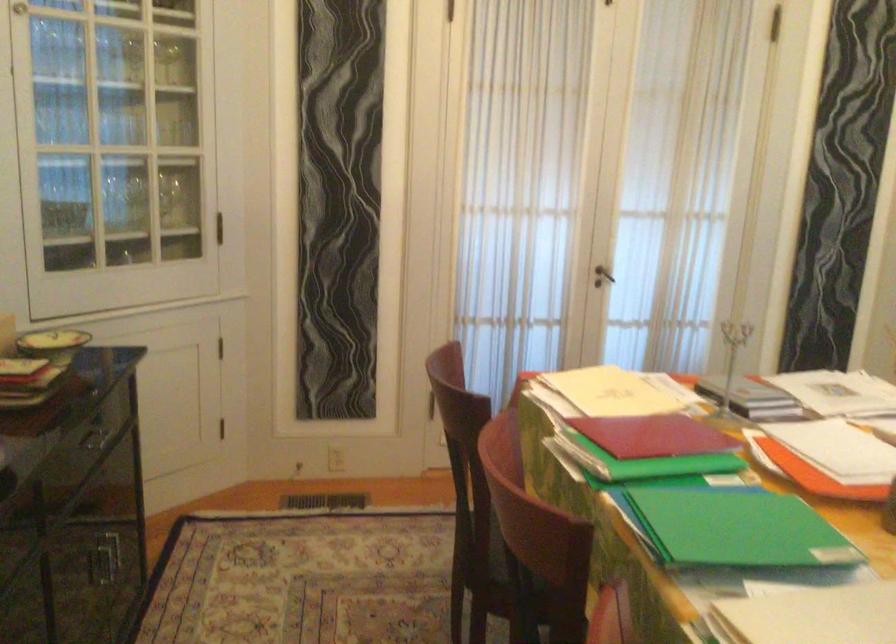
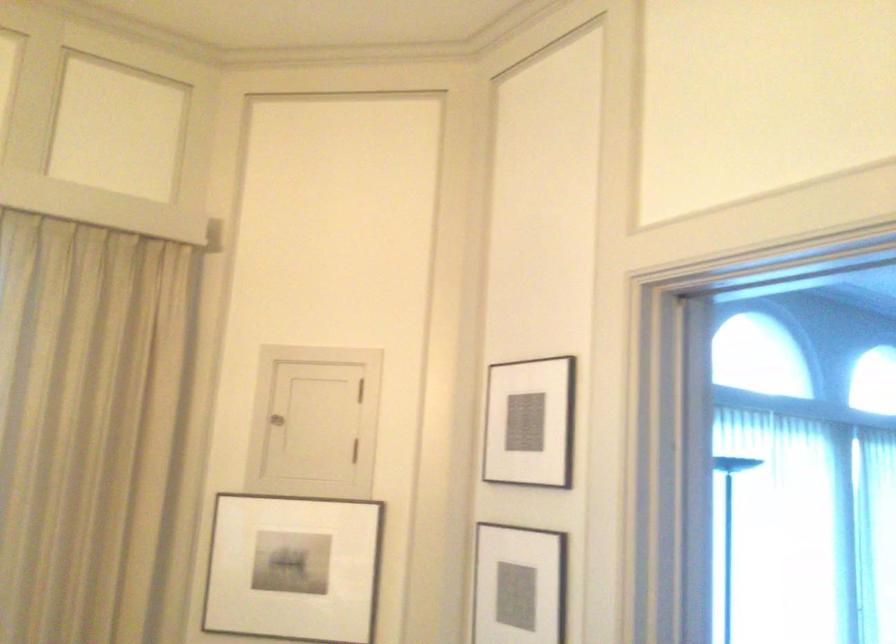
Question: Based on the continuous images, in which direction is the camera rotating? Reply with the corresponding letter.

Choices:
 (A) Left
 (B) Right
 (C) Up
 (D) Down

Answer: (B)